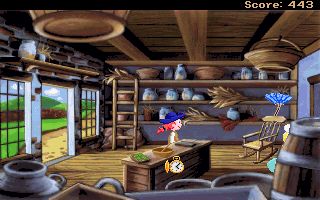
Locate an element on the screen. door is located at coordinates (71, 139), (312, 102).